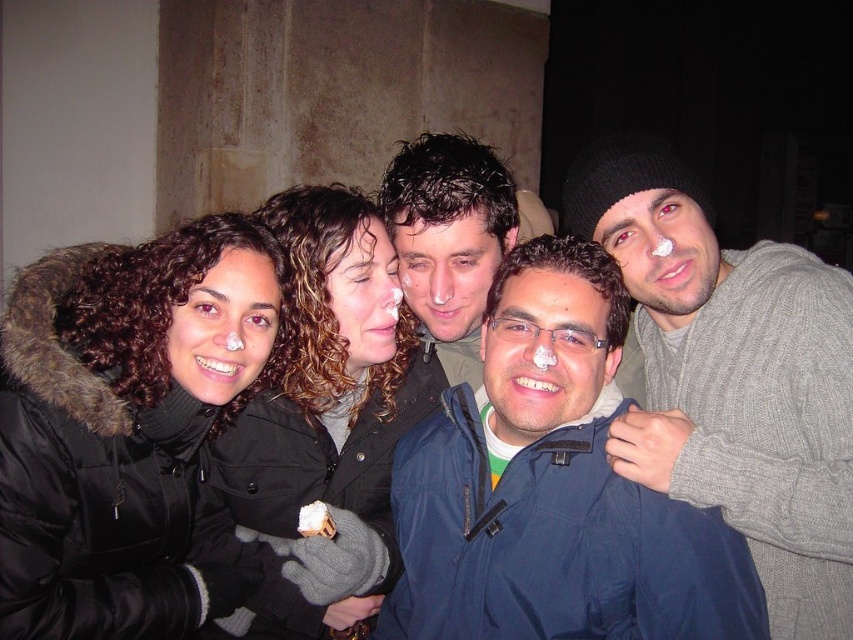
You are standing in the same spot as the photographer who took the photo. Looking at the group of people, which jacket is positioned more to the right between the blue fabric jacket at center and the black matte jacket at center?

The blue fabric jacket at center is positioned more to the right than the black matte jacket at center.